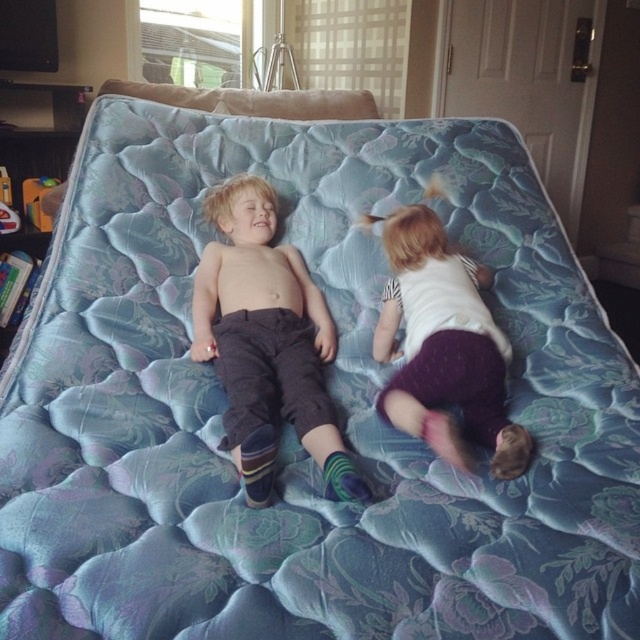
You are taking a photo of the two children on the mattress. You want to focus on the point closer to the camera. Which point should you choose between point (x=323, y=465) and point (x=472, y=358)?

You should focus on point (x=323, y=465) because it is closer to the camera than point (x=472, y=358).

You are a photographer trying to capture a closeup of the point at coordinates (266,342) in the image. Given that the point is on matte gray pants at center, which object from the list should you focus on to ensure the point is in your shot?

The point at coordinates (266,342) is located on the matte gray pants at center, so focusing on that object will ensure the point is captured in the shot.

You are a photographer setting up a camera at eye level with the children. You need to ensure that both the matte gray pants at center and the matte white shirt at center are fully visible in the frame. Based on their heights, which object should you focus on first to adjust the camera angle?

The matte gray pants at center is taller than the matte white shirt at center, so you should focus on the matte gray pants at center first to adjust the camera angle to capture its full height, ensuring the matte white shirt at center is also in view.